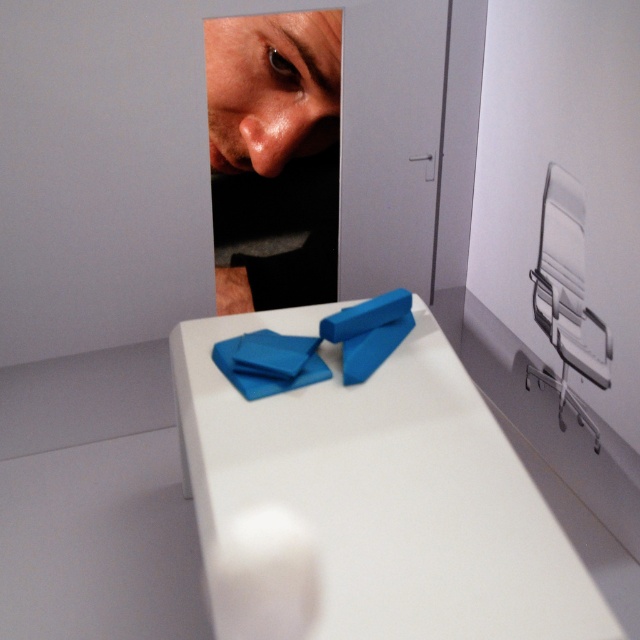
Is point (244, 403) positioned after point (278, 36)?

No, it is not.

Where is `white glossy table at center`? This screenshot has height=640, width=640. white glossy table at center is located at coordinates (369, 500).